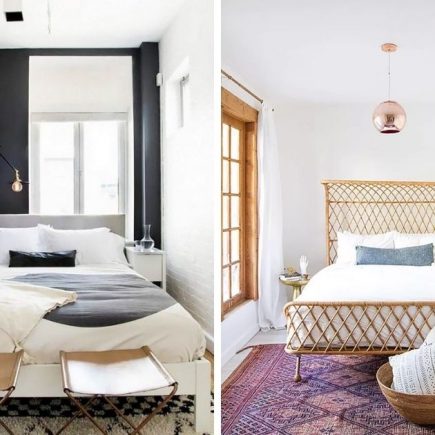
I want to click on curtains, so click(x=145, y=178), click(x=17, y=122).